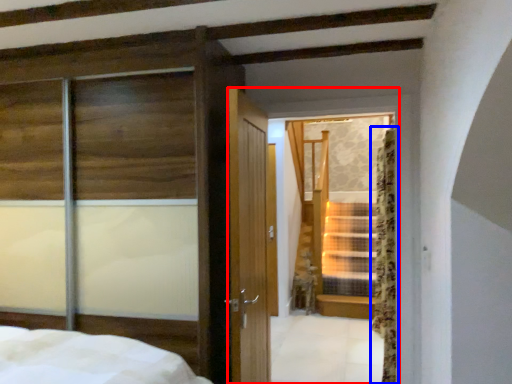
Question: Which object is closer to the camera taking this photo, glass door (highlighted by a red box) or curtain (highlighted by a blue box)?

Choices:
 (A) glass door
 (B) curtain

Answer: (A)